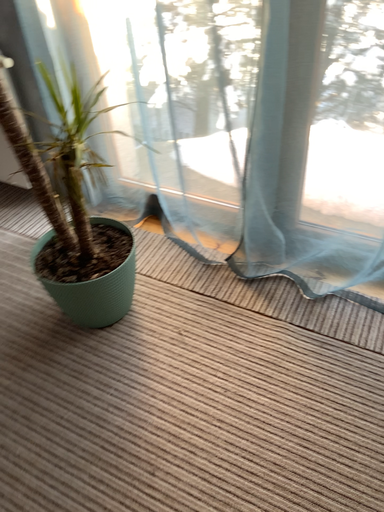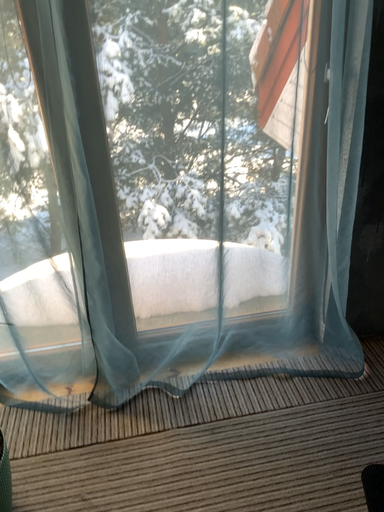
Question: How did the camera likely rotate when shooting the video?

Choices:
 (A) rotated left
 (B) rotated right

Answer: (B)